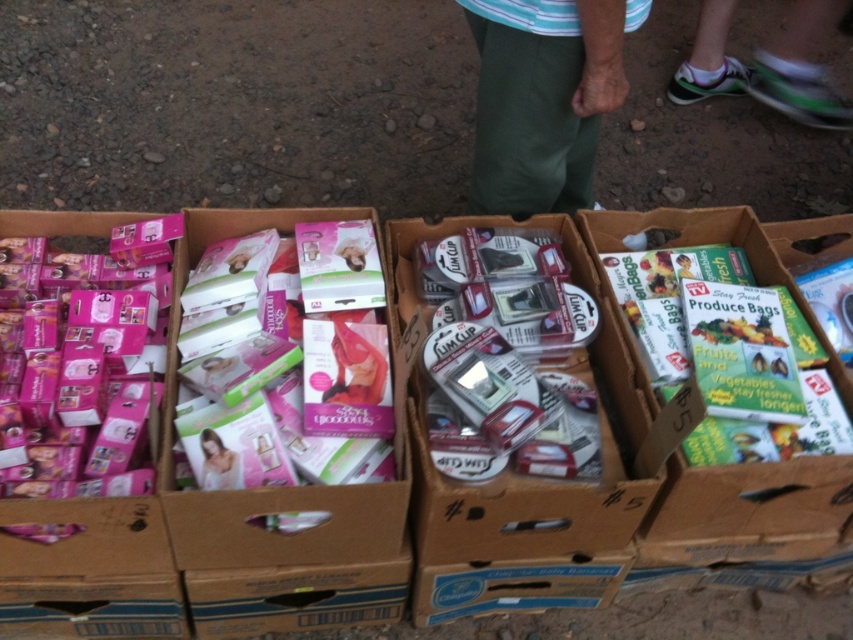
Question: Among these objects, which one is farthest from the camera?

Choices:
 (A) green cotton pants at center
 (B) white mesh shoe at upper right
 (C) green matte produce bags at lower right
 (D) pink matte baby carrier at center

Answer: (B)

Question: Is green cotton pants at center bigger than white mesh shoe at upper right?

Choices:
 (A) no
 (B) yes

Answer: (A)

Question: Which point is closer to the camera taking this photo?

Choices:
 (A) (674, 531)
 (B) (231, 468)
 (C) (531, 122)
 (D) (721, 33)

Answer: (B)

Question: Is white mesh shoe at upper right thinner than pink matte baby carrier at center?

Choices:
 (A) no
 (B) yes

Answer: (A)

Question: Based on their relative distances, which object is farther from the green cotton pants at center?

Choices:
 (A) pink matte baby carrier at center
 (B) white mesh shoe at upper right
 (C) green matte produce bags at lower right

Answer: (B)

Question: Can you confirm if green matte produce bags at lower right is thinner than white mesh shoe at upper right?

Choices:
 (A) no
 (B) yes

Answer: (B)